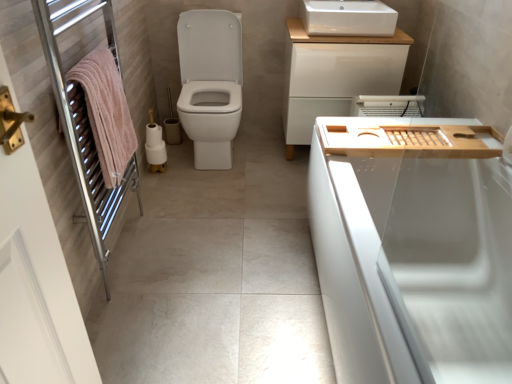
Question: Looking at their shapes, would you say white glossy bathtub at right is wider or thinner than pink towel at left?

Choices:
 (A) thin
 (B) wide

Answer: (B)

Question: Is point (336, 192) positioned closer to the camera than point (134, 187)?

Choices:
 (A) closer
 (B) farther

Answer: (A)

Question: Which object is the closest to the white matte toilet paper at center?

Choices:
 (A) white glossy bathtub at right
 (B) white matte cabinet at upper center
 (C) wooden tray at right
 (D) white ceramic sink at upper center
 (E) white glossy toilet at center

Answer: (E)

Question: Which of these objects is positioned farthest from the white glossy toilet at center?

Choices:
 (A) white ceramic sink at upper center
 (B) white glossy bathtub at right
 (C) pink towel at left
 (D) wooden tray at right
 (E) white matte cabinet at upper center

Answer: (B)